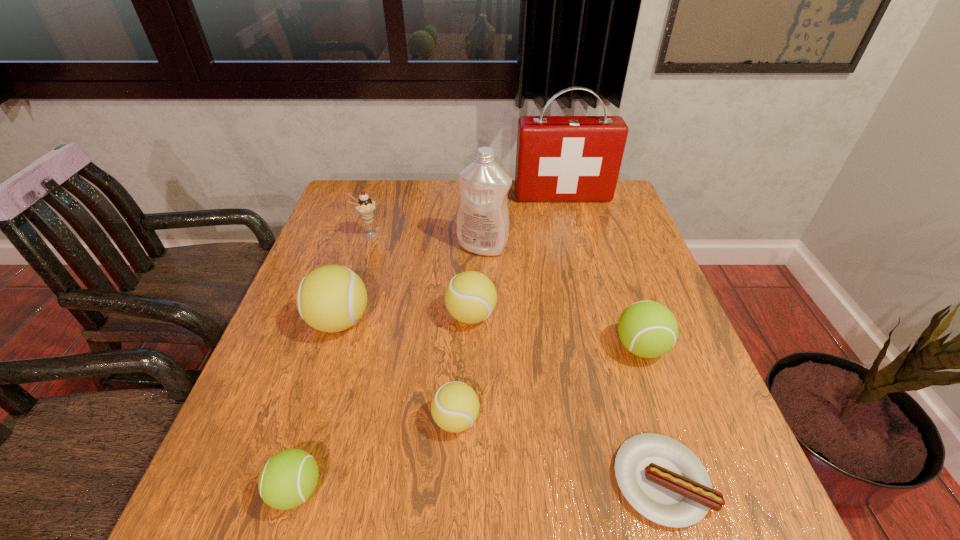
Where is `the smallest yellow tennis ball`? The image size is (960, 540). the smallest yellow tennis ball is located at coordinates (455, 406).

Where is `the nearest yellow tennis ball`? the nearest yellow tennis ball is located at coordinates (455, 406).

The width and height of the screenshot is (960, 540). In order to click on the nearest tennis ball in this screenshot , I will do `click(288, 479)`.

This screenshot has height=540, width=960. Find the location of `the nearer green tennis ball`. the nearer green tennis ball is located at coordinates (288, 479).

Where is `the shortest object`? This screenshot has width=960, height=540. the shortest object is located at coordinates (663, 480).

The height and width of the screenshot is (540, 960). In order to click on free space located on the front face of the tallest object in this screenshot , I will do `click(577, 253)`.

Find the location of a particular element. The image size is (960, 540). free space located on the back of the second tallest object is located at coordinates (483, 221).

Where is `free space located on the back of the icecream`? The width and height of the screenshot is (960, 540). free space located on the back of the icecream is located at coordinates (381, 195).

What are the coordinates of `free space located 0.210m on the right of the leftmost yellow tennis ball` in the screenshot? It's located at (462, 321).

Identify the location of vacant space located 0.120m on the front of the second biggest yellow tennis ball. The width and height of the screenshot is (960, 540). (469, 380).